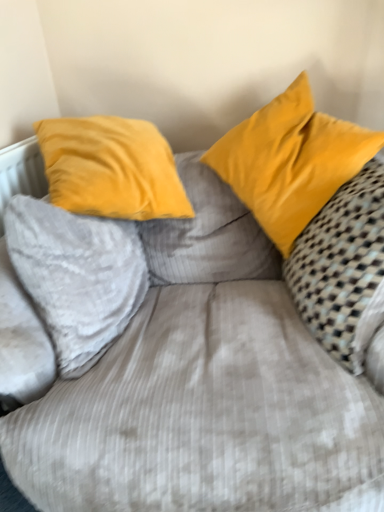
Question: Would you say velvet yellow pillow at upper left, the 1th pillow when ordered from left to right, contains yellow velvet pillow at upper right, marked as the 2th pillow in a left-to-right arrangement?

Choices:
 (A) no
 (B) yes

Answer: (A)

Question: Does velvet yellow pillow at upper left, the 3th pillow in the right-to-left sequence, have a smaller size compared to yellow velvet pillow at upper right, marked as the 2th pillow in a left-to-right arrangement?

Choices:
 (A) yes
 (B) no

Answer: (A)

Question: Does velvet yellow pillow at upper left, the 1th pillow when ordered from left to right, have a larger size compared to yellow velvet pillow at upper right, which is the second pillow in right-to-left order?

Choices:
 (A) yes
 (B) no

Answer: (B)

Question: From a real-world perspective, is velvet yellow pillow at upper left, the 1th pillow when ordered from left to right, below yellow velvet pillow at upper right, marked as the 2th pillow in a left-to-right arrangement?

Choices:
 (A) no
 (B) yes

Answer: (B)

Question: From a real-world perspective, does velvet yellow pillow at upper left, the 1th pillow when ordered from left to right, stand above yellow velvet pillow at upper right, marked as the 2th pillow in a left-to-right arrangement?

Choices:
 (A) yes
 (B) no

Answer: (B)

Question: Is velvet yellow pillow at upper left, the 3th pillow in the right-to-left sequence, shorter than yellow velvet pillow at upper right, marked as the 2th pillow in a left-to-right arrangement?

Choices:
 (A) yes
 (B) no

Answer: (A)

Question: Is velvet yellow pillow at upper left, the 3th pillow in the right-to-left sequence, next to velvet yellow pillow at right, which is the 1th pillow from right to left, and touching it?

Choices:
 (A) yes
 (B) no

Answer: (B)

Question: Can you confirm if velvet yellow pillow at upper left, the 3th pillow in the right-to-left sequence, is bigger than velvet yellow pillow at right, which is the 1th pillow from right to left?

Choices:
 (A) no
 (B) yes

Answer: (A)

Question: Is velvet yellow pillow at upper left, the 3th pillow in the right-to-left sequence, oriented towards velvet yellow pillow at right, the third pillow in the left-to-right sequence?

Choices:
 (A) yes
 (B) no

Answer: (A)

Question: Considering the relative positions of velvet yellow pillow at upper left, the 3th pillow in the right-to-left sequence, and velvet yellow pillow at right, the third pillow in the left-to-right sequence, in the image provided, is velvet yellow pillow at upper left, the 3th pillow in the right-to-left sequence, to the left of velvet yellow pillow at right, the third pillow in the left-to-right sequence, from the viewer's perspective?

Choices:
 (A) yes
 (B) no

Answer: (A)

Question: Is velvet yellow pillow at upper left, the 1th pillow when ordered from left to right, at the right side of velvet yellow pillow at right, which is the 1th pillow from right to left?

Choices:
 (A) no
 (B) yes

Answer: (A)

Question: From the image's perspective, is velvet yellow pillow at upper left, the 1th pillow when ordered from left to right, over velvet yellow pillow at right, the third pillow in the left-to-right sequence?

Choices:
 (A) yes
 (B) no

Answer: (B)

Question: Does yellow velvet pillow at upper right, marked as the 2th pillow in a left-to-right arrangement, have a lesser height compared to velvet yellow pillow at upper left, the 3th pillow in the right-to-left sequence?

Choices:
 (A) no
 (B) yes

Answer: (A)